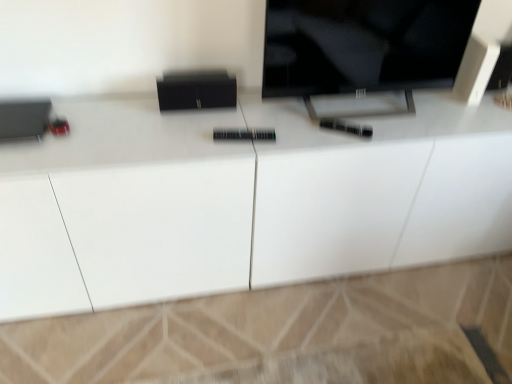
Locate an element on the screen. The height and width of the screenshot is (384, 512). vacant space that is to the left of black glossy tv at upper center is located at coordinates (252, 126).